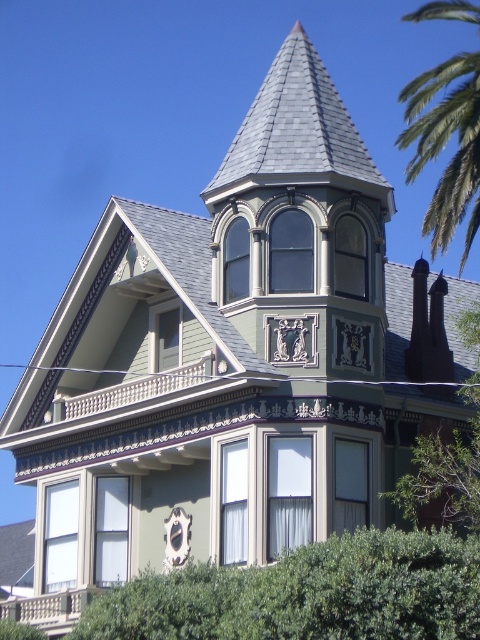
You are a window washer standing on the ground near the stone balustrade at lower left. You look up and see the green leafy palm tree at upper right. Which object is closer to the top edge of the image?

The green leafy palm tree at upper right is closer to the top edge of the image because it is positioned at the upper right, while the stone balustrade at lower left is at the lower left.

You are standing in front of the Victorian house and want to know if the green leafy palm tree at upper right can be seen from the stone balustrade at lower left. Based on their positions, what do you think?

The green leafy palm tree at upper right is above the stone balustrade at lower left, so yes, it can be seen from there as it is positioned higher up.